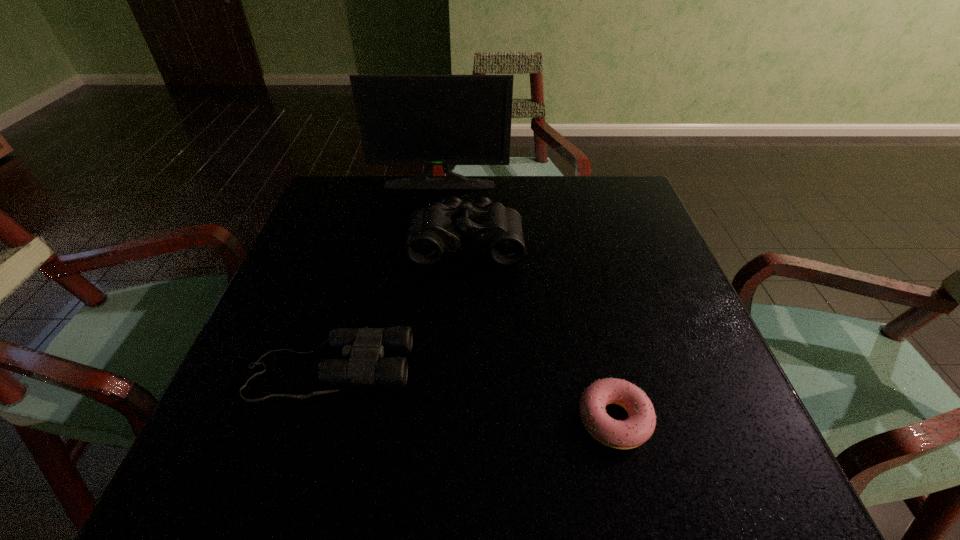
Image resolution: width=960 pixels, height=540 pixels. I want to click on free spot between the rightmost object and the farther binoculars, so click(540, 331).

Find the location of a particular element. This screenshot has width=960, height=540. vacant space that is in between the doughnut and the farthest object is located at coordinates (527, 302).

The image size is (960, 540). I want to click on unoccupied area between the second shortest object and the doughnut, so [472, 394].

I want to click on vacant area that lies between the shorter binoculars and the second farthest object, so click(x=398, y=306).

Identify the location of free area in between the second tallest object and the shortest object. This screenshot has width=960, height=540. (540, 331).

Point out which object is positioned as the second nearest to the monitor. Please provide its 2D coordinates. Your answer should be formatted as a tuple, i.e. [(x, y)], where the tuple contains the x and y coordinates of a point satisfying the conditions above.

[(363, 348)]

Image resolution: width=960 pixels, height=540 pixels. In order to click on object that stands as the third closest to the farther binoculars in this screenshot , I will do `click(639, 426)`.

The width and height of the screenshot is (960, 540). What are the coordinates of `vacant space that satisfies the following two spatial constraints: 1. on the front-facing side of the tallest object; 2. at the eyepiece of the nearer binoculars` in the screenshot? It's located at (416, 369).

I want to click on vacant space that satisfies the following two spatial constraints: 1. at the eyepieces of the taller binoculars; 2. at the eyepiece of the nearer binoculars, so click(462, 369).

Find the location of a particular element. vacant area that satisfies the following two spatial constraints: 1. at the eyepieces of the farther binoculars; 2. at the eyepiece of the shorter binoculars is located at coordinates (462, 369).